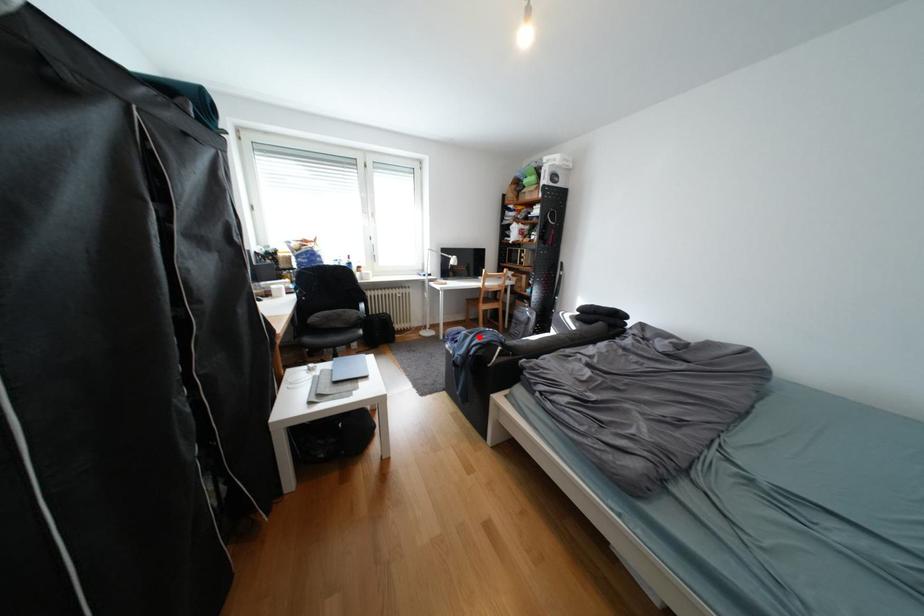
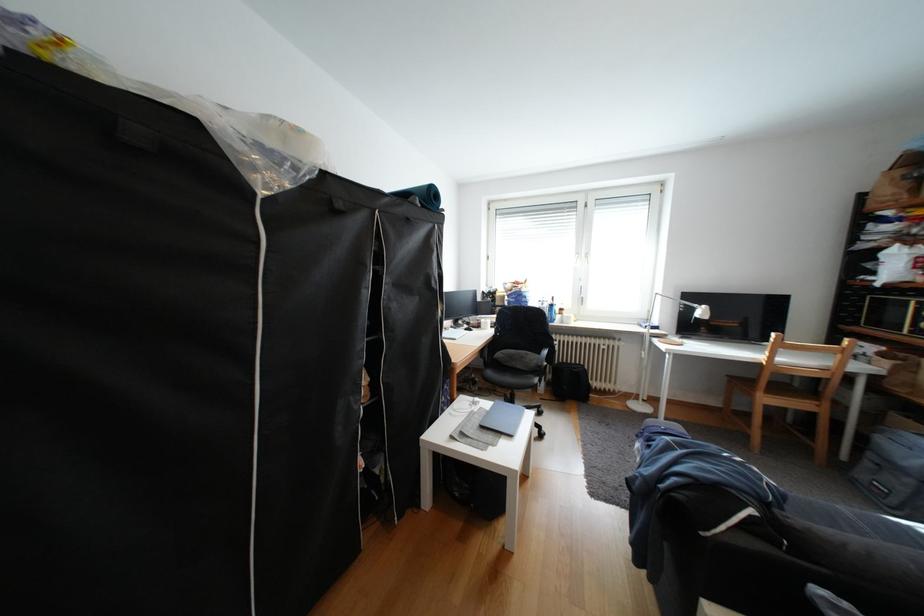
Find the pixel in the second image that matches the highlighted location in the first image.

(682, 448)